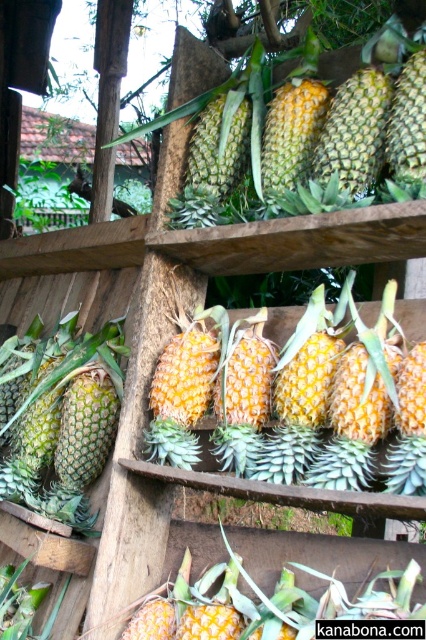
You are a fruit seller who needs to arrange pineapples on a shelf. You have two pineapples in front of you, the yellow matte pineapple at center and the green spiky pineapple at center. According to their current positions, which pineapple is positioned more to the left?

The yellow matte pineapple at center is positioned more to the left than the green spiky pineapple at center.